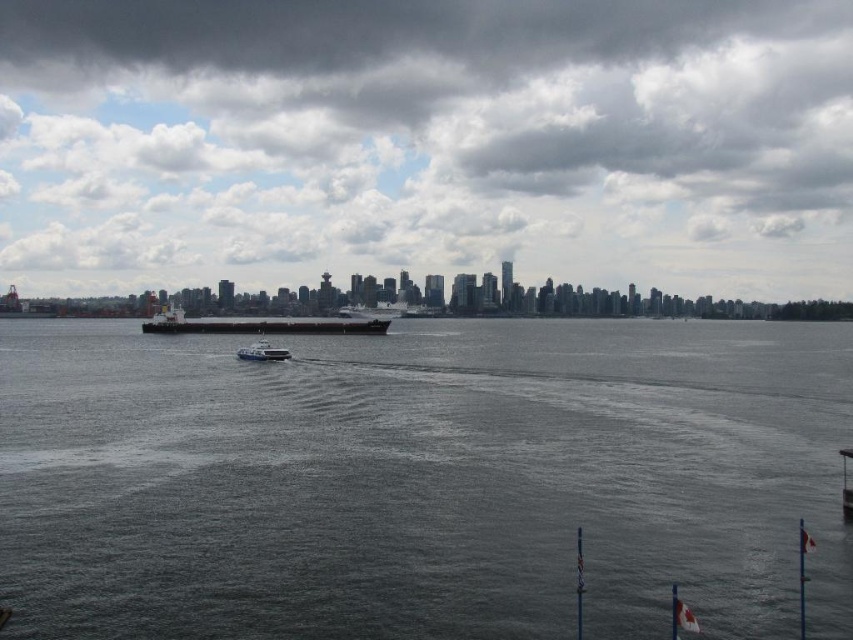
Question: Does dark gray water at center appear over cloudy sky at upper center?

Choices:
 (A) no
 (B) yes

Answer: (A)

Question: Considering the relative positions of matte black ship at center and white plastic boat at center in the image provided, where is matte black ship at center located with respect to white plastic boat at center?

Choices:
 (A) left
 (B) right

Answer: (A)

Question: Which object is closer to the camera taking this photo?

Choices:
 (A) white plastic boat at center
 (B) cloudy sky at upper center

Answer: (A)

Question: Which object appears farthest from the camera in this image?

Choices:
 (A) white plastic boat at center
 (B) matte black ship at center

Answer: (B)

Question: Where is matte black ship at center located in relation to white plastic boat at center in the image?

Choices:
 (A) above
 (B) below

Answer: (A)

Question: Among these points, which one is nearest to the camera?

Choices:
 (A) (183, 314)
 (B) (378, 413)
 (C) (525, 188)
 (D) (264, 339)

Answer: (B)